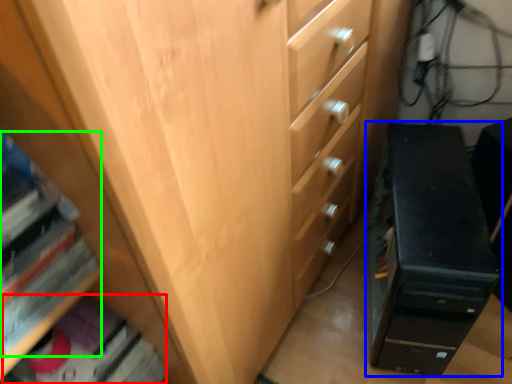
Question: Estimate the real-world distances between objects in this image. Which object is farther from book (highlighted by a red box), chest of drawers (highlighted by a blue box) or book (highlighted by a green box)?

Choices:
 (A) chest of drawers
 (B) book

Answer: (A)